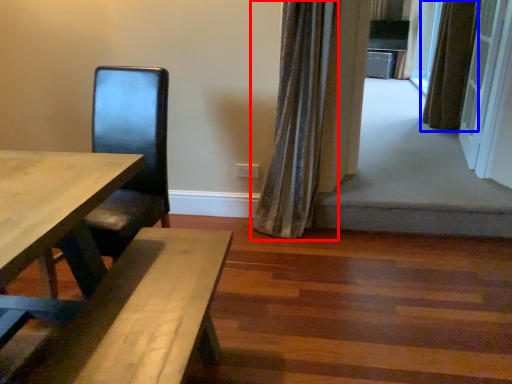
Question: Which object appears closest to the camera in this image, curtain (highlighted by a red box) or curtain (highlighted by a blue box)?

Choices:
 (A) curtain
 (B) curtain

Answer: (A)